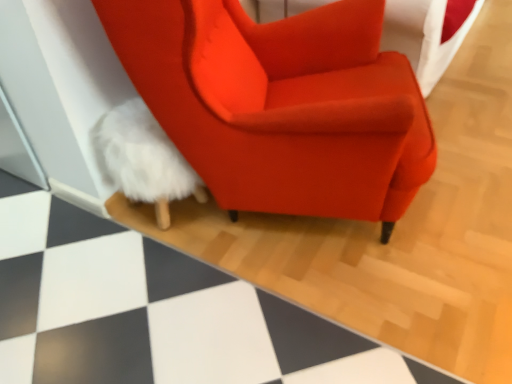
Question: Is white fluffy bean bag at lower left situated inside white fluffy rug at lower left or outside?

Choices:
 (A) outside
 (B) inside

Answer: (A)

Question: From their relative heights in the image, would you say white fluffy bean bag at lower left is taller or shorter than white fluffy rug at lower left?

Choices:
 (A) short
 (B) tall

Answer: (B)

Question: Which object is the farthest from the white fluffy rug at lower left?

Choices:
 (A) satin orange armchair at center
 (B) white fluffy bean bag at lower left

Answer: (A)

Question: Which of these objects is positioned closest to the white fluffy rug at lower left?

Choices:
 (A) satin orange armchair at center
 (B) white fluffy bean bag at lower left

Answer: (B)